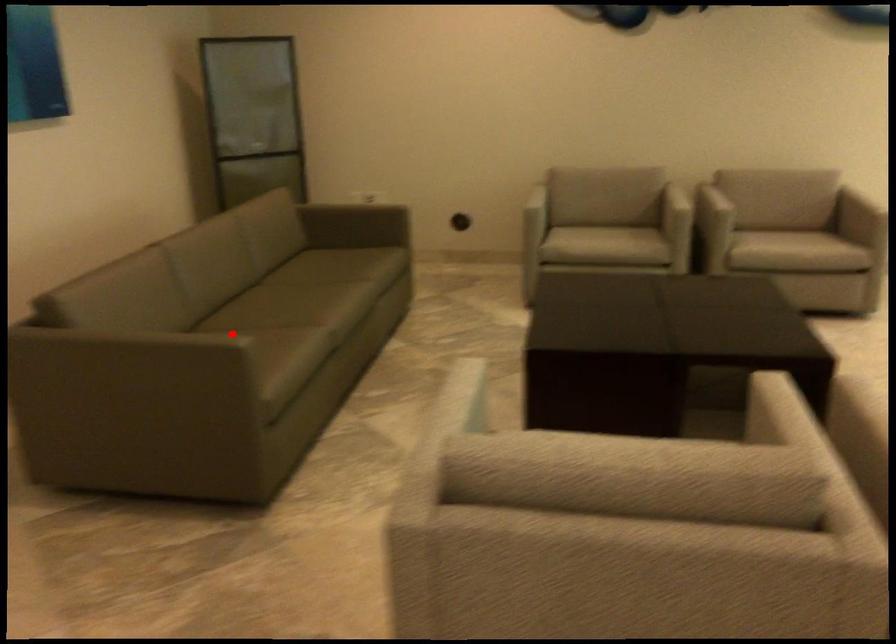
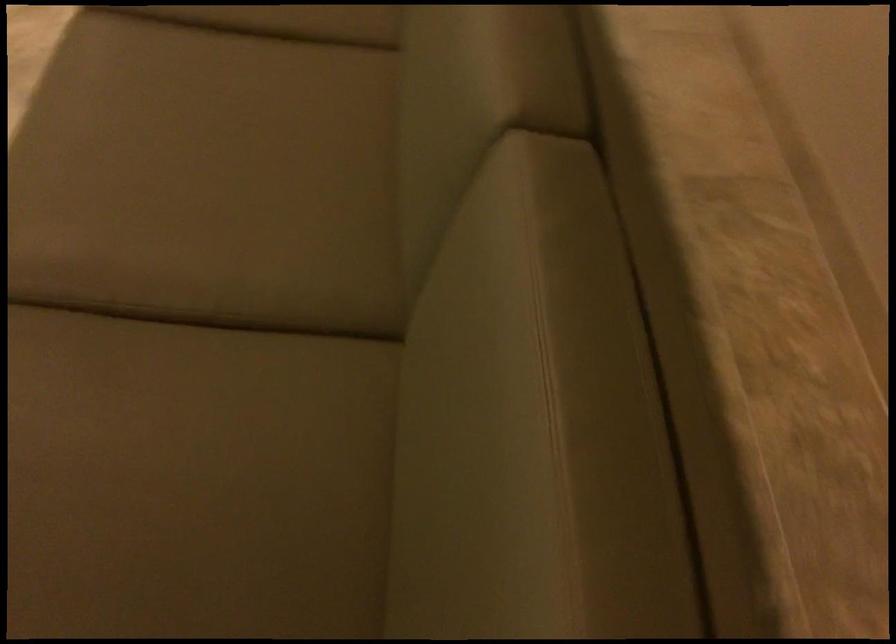
The point at the highlighted location is marked in the first image. Where is the corresponding point in the second image?

(286, 20)